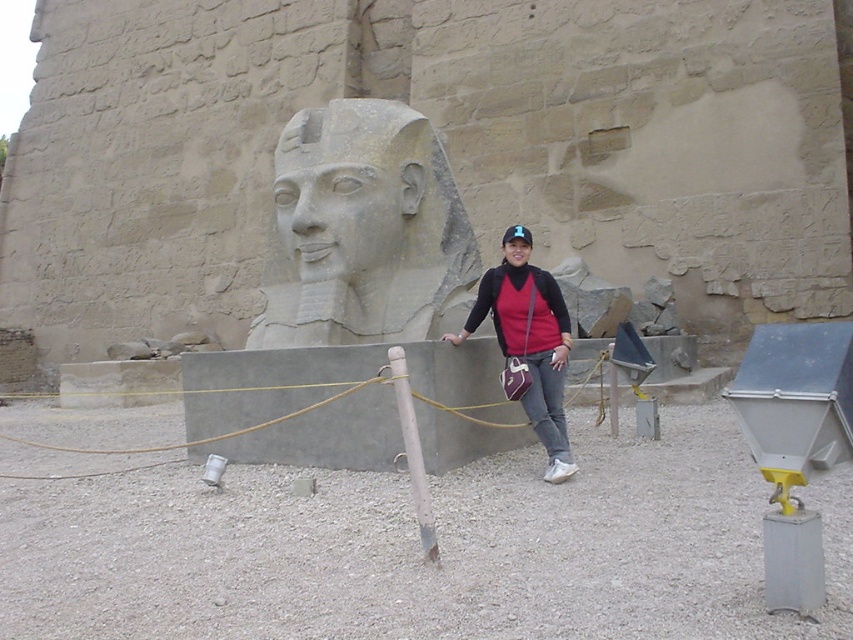
You are a tour guide explaining the ancient Egyptian site to visitors. You want to mention the relative sizes of the gray stone head at center and the white wood pole at center. How would you describe their widths?

The gray stone head at center is wider than the white wood pole at center.